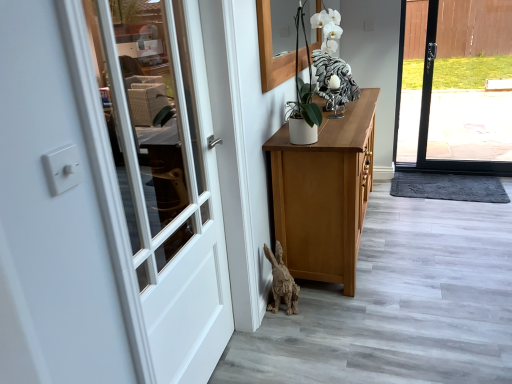
What do you see at coordinates (281, 282) in the screenshot?
I see `wooden rabbit at lower center, the 1th animal positioned from the bottom` at bounding box center [281, 282].

This screenshot has height=384, width=512. I want to click on wooden frame at upper center, so click(x=271, y=51).

From the image's perspective, is wooden frame at upper center above or below dark gray textured mat at lower right?

Clearly, from the image's perspective, wooden frame at upper center is above dark gray textured mat at lower right.

This screenshot has height=384, width=512. Find the location of `window on the left of the dark gray textured mat at lower right`. window on the left of the dark gray textured mat at lower right is located at coordinates (271, 51).

Considering the positions of objects wooden frame at upper center and dark gray textured mat at lower right in the image provided, who is more to the left, wooden frame at upper center or dark gray textured mat at lower right?

Positioned to the left is wooden frame at upper center.

Between wooden frame at upper center and dark gray textured mat at lower right, which one has smaller width?

Thinner between the two is wooden frame at upper center.

From the image's perspective, does white glossy rooster at upper center, the 2th animal positioned from the bottom, appear higher than dark gray textured mat at lower right?

Yes, from the image's perspective, white glossy rooster at upper center, the 2th animal positioned from the bottom, is above dark gray textured mat at lower right.

At what (x,y) coordinates should I click in order to perform the action: click on doormat located below the white glossy rooster at upper center, placed as the 1th animal when sorted from back to front (from the image's perspective). Please return your answer as a coordinate pair (x, y). This screenshot has width=512, height=384. Looking at the image, I should click on (448, 187).

Is white glossy rooster at upper center, acting as the second animal starting from the left, positioned beyond the bounds of dark gray textured mat at lower right?

Yes, white glossy rooster at upper center, acting as the second animal starting from the left, is not within dark gray textured mat at lower right.

In the scene shown: Between white glossy rooster at upper center, placed as the 1th animal when sorted from back to front, and dark gray textured mat at lower right, which one appears on the right side from the viewer's perspective?

From the viewer's perspective, dark gray textured mat at lower right appears more on the right side.

Which is in front, white wood door at left or white glossy rooster at upper center, the 2th animal positioned from the bottom?

white wood door at left is in front.

Who is shorter, white wood door at left or white glossy rooster at upper center, which appears as the first animal when viewed from the right?

white glossy rooster at upper center, which appears as the first animal when viewed from the right, is shorter.

Find the location of a particular element. This screenshot has height=384, width=512. the 2nd animal behind the white wood door at left is located at coordinates (334, 82).

From a real-world perspective, does white wood door at left sit lower than white glossy rooster at upper center, acting as the 2th animal starting from the front?

Yes, from a real-world perspective, white wood door at left is under white glossy rooster at upper center, acting as the 2th animal starting from the front.

Is wooden rabbit at lower center, the 1th animal viewed from the left, turned away from wooden frame at upper center?

No, wooden rabbit at lower center, the 1th animal viewed from the left, is not facing the opposite direction of wooden frame at upper center.

From a real-world perspective, is wooden rabbit at lower center, the 1th animal viewed from the left, physically located above or below wooden frame at upper center?

wooden rabbit at lower center, the 1th animal viewed from the left, is situated lower than wooden frame at upper center in the real world.

Considering the positions of point (285, 269) and point (320, 38), is point (285, 269) closer or farther from the camera than point (320, 38)?

Point (285, 269) is farther from the camera than point (320, 38).

Is wooden rabbit at lower center, the second animal viewed from the right, next to wooden frame at upper center?

No, wooden rabbit at lower center, the second animal viewed from the right, is not next to wooden frame at upper center.

Looking at this image, is wooden rabbit at lower center, the second animal from the back, bigger or smaller than white wood door at left?

Considering their sizes, wooden rabbit at lower center, the second animal from the back, takes up less space than white wood door at left.

From a real-world perspective, is wooden rabbit at lower center, the second animal viewed from the right, over white wood door at left?

No, from a real-world perspective, wooden rabbit at lower center, the second animal viewed from the right, is not above white wood door at left.

Considering the points (280, 264) and (177, 126), which point is in front, point (280, 264) or point (177, 126)?

The point (280, 264) is in front.

Locate an element on the screen. The height and width of the screenshot is (384, 512). door that is below the dark gray textured mat at lower right (from the image's perspective) is located at coordinates (166, 177).

Does dark gray textured mat at lower right have a smaller size compared to white wood door at left?

Indeed, dark gray textured mat at lower right has a smaller size compared to white wood door at left.

Can white wood door at left be found inside dark gray textured mat at lower right?

Actually, white wood door at left is outside dark gray textured mat at lower right.

Considering the relative positions of white glossy rooster at upper center, acting as the 2th animal starting from the front, and wooden rabbit at lower center, the 1th animal viewed from the left, in the image provided, is white glossy rooster at upper center, acting as the 2th animal starting from the front, to the right of wooden rabbit at lower center, the 1th animal viewed from the left, from the viewer's perspective?

Yes, white glossy rooster at upper center, acting as the 2th animal starting from the front, is to the right of wooden rabbit at lower center, the 1th animal viewed from the left.

Is white glossy rooster at upper center, the 2th animal positioned from the bottom, oriented away from wooden rabbit at lower center, the second animal viewed from the right?

No, white glossy rooster at upper center, the 2th animal positioned from the bottom,'s orientation is not away from wooden rabbit at lower center, the second animal viewed from the right.

From a real-world perspective, which object stands above the other?

From a 3D spatial view, white glossy rooster at upper center, placed as the 1th animal when sorted from back to front, is above.

Identify the location of window on the left of dark gray textured mat at lower right. (271, 51).

Image resolution: width=512 pixels, height=384 pixels. I want to click on doormat lying behind the white glossy rooster at upper center, acting as the 2th animal starting from the front, so click(x=448, y=187).

From the image, which object appears to be farther from wooden frame at upper center, dark gray textured mat at lower right or white glossy rooster at upper center, placed as the 1th animal when sorted from back to front?

dark gray textured mat at lower right.

Estimate the real-world distances between objects in this image. Which object is closer to wooden frame at upper center, white wood door at left or dark gray textured mat at lower right?

white wood door at left lies closer to wooden frame at upper center than the other object.

Considering their positions, is dark gray textured mat at lower right positioned closer to white wood door at left than white glossy rooster at upper center, which appears as the first animal when viewed from the right?

Among the two, white glossy rooster at upper center, which appears as the first animal when viewed from the right, is located nearer to white wood door at left.

Considering their positions, is dark gray textured mat at lower right positioned further to white wood door at left than wooden frame at upper center?

dark gray textured mat at lower right is positioned further to the anchor white wood door at left.

Estimate the real-world distances between objects in this image. Which object is further from wooden rabbit at lower center, which is the second animal in top-to-bottom order, dark gray textured mat at lower right or white wood door at left?

dark gray textured mat at lower right is further to wooden rabbit at lower center, which is the second animal in top-to-bottom order.

Considering their positions, is wooden rabbit at lower center, which is the second animal in top-to-bottom order, positioned closer to dark gray textured mat at lower right than white glossy rooster at upper center, placed as the 1th animal when sorted from back to front?

white glossy rooster at upper center, placed as the 1th animal when sorted from back to front, lies closer to dark gray textured mat at lower right than the other object.

From the image, which object appears to be nearer to dark gray textured mat at lower right, white wood door at left or wooden frame at upper center?

Based on the image, wooden frame at upper center appears to be nearer to dark gray textured mat at lower right.

Looking at the image, which one is located further to white glossy rooster at upper center, placed as the 1th animal when sorted from back to front, white wood door at left or wooden rabbit at lower center, the second animal viewed from the right?

The object further to white glossy rooster at upper center, placed as the 1th animal when sorted from back to front, is white wood door at left.

Find the location of `door that lies between wooden frame at upper center and wooden rabbit at lower center, the 1th animal positioned from the bottom, from top to bottom`. door that lies between wooden frame at upper center and wooden rabbit at lower center, the 1th animal positioned from the bottom, from top to bottom is located at coordinates click(166, 177).

At what (x,y) coordinates should I click in order to perform the action: click on window between wooden rabbit at lower center, arranged as the first animal when viewed from the front, and dark gray textured mat at lower right. Please return your answer as a coordinate pair (x, y). Looking at the image, I should click on (271, 51).

The image size is (512, 384). In order to click on animal between wooden rabbit at lower center, the second animal from the back, and dark gray textured mat at lower right in this screenshot , I will do `click(334, 82)`.

This screenshot has width=512, height=384. I want to click on animal located between white wood door at left and white glossy rooster at upper center, the 1th animal positioned from the top, in the depth direction, so click(x=281, y=282).